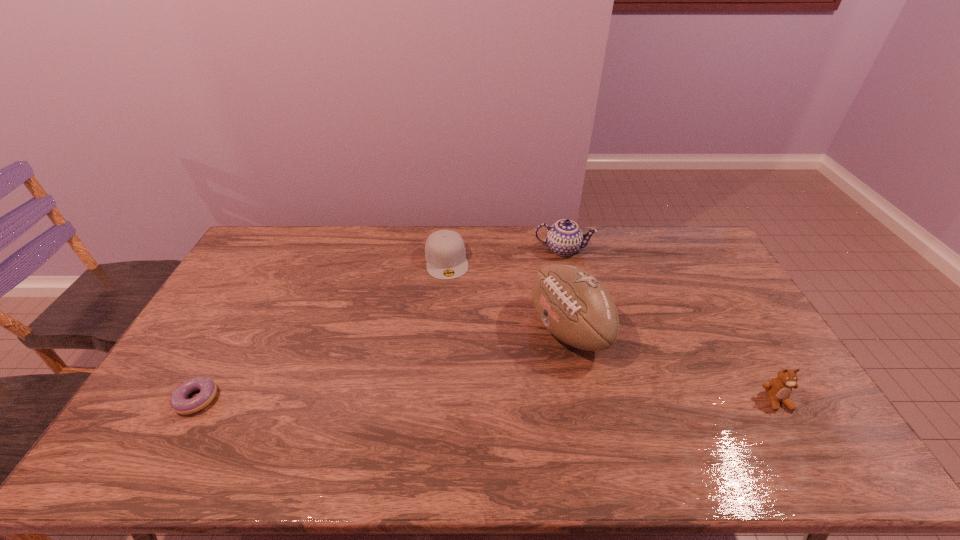
I want to click on free space located 0.150m on the front-facing side of the cap, so click(x=454, y=309).

This screenshot has height=540, width=960. In order to click on vacant space located 0.160m on the front-facing side of the cap in this screenshot , I will do `click(455, 312)`.

Locate an element on the screen. vacant space located 0.090m on the front-facing side of the cap is located at coordinates (452, 297).

Find the location of a particular element. Image resolution: width=960 pixels, height=540 pixels. free spot located on the laces of the tallest object is located at coordinates (511, 362).

Where is `vacant space located 0.100m on the laces of the tallest object`? The height and width of the screenshot is (540, 960). vacant space located 0.100m on the laces of the tallest object is located at coordinates (511, 362).

The height and width of the screenshot is (540, 960). Identify the location of vacant space located on the laces of the tallest object. (422, 404).

This screenshot has width=960, height=540. In order to click on free space located at the spout of the chinaware in this screenshot , I will do `click(558, 272)`.

Locate an element on the screen. vacant space located 0.200m at the spout of the chinaware is located at coordinates (555, 296).

At what (x,y) coordinates should I click in order to perform the action: click on vacant space located at the spout of the chinaware. Please return your answer as a coordinate pair (x, y). The image size is (960, 540). Looking at the image, I should click on (549, 338).

The height and width of the screenshot is (540, 960). Find the location of `cap that is at the far edge`. cap that is at the far edge is located at coordinates (445, 253).